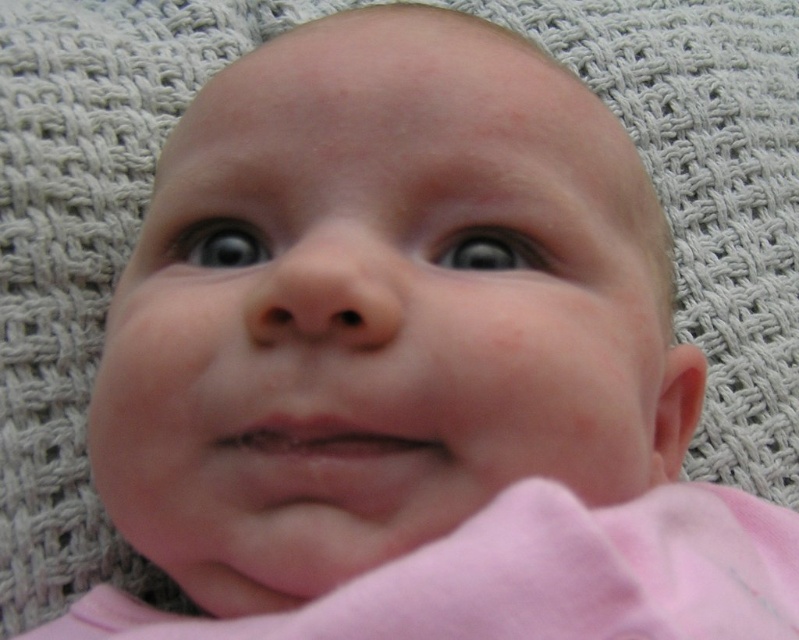
You are a photographer taking a close up of a baby. You notice two points on the baby, one at point (507, 259) and another at point (227, 244). Which point is closer to your camera?

Point (507, 259) is closer to the camera than point (227, 244).